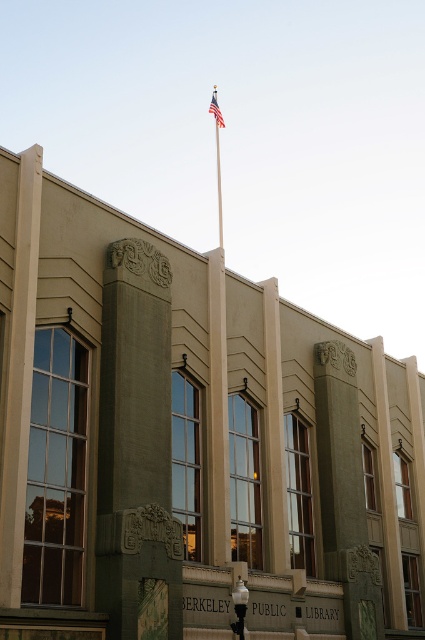
You are standing in front of the Berkeley Public Library and notice the polished metal flag pole at upper center and the american flag at upper center. Which object is located higher up in the image?

The american flag at upper center is located higher up because the polished metal flag pole at upper center is positioned under it.

You are standing in front of the Berkeley Public Library and notice the polished metal flag pole at upper center and the american flag at upper center. Which object is bigger in size?

The polished metal flag pole at upper center is larger in size compared to the american flag at upper center.

You are standing in front of the Berkeley Public Library and notice two points marked on the building. The first point is at coordinates point (220, 236) and the second is at point (215, 113). Which point is closer to you?

Point (215, 113) is closer to you because it is less further to the camera than point (220, 236).